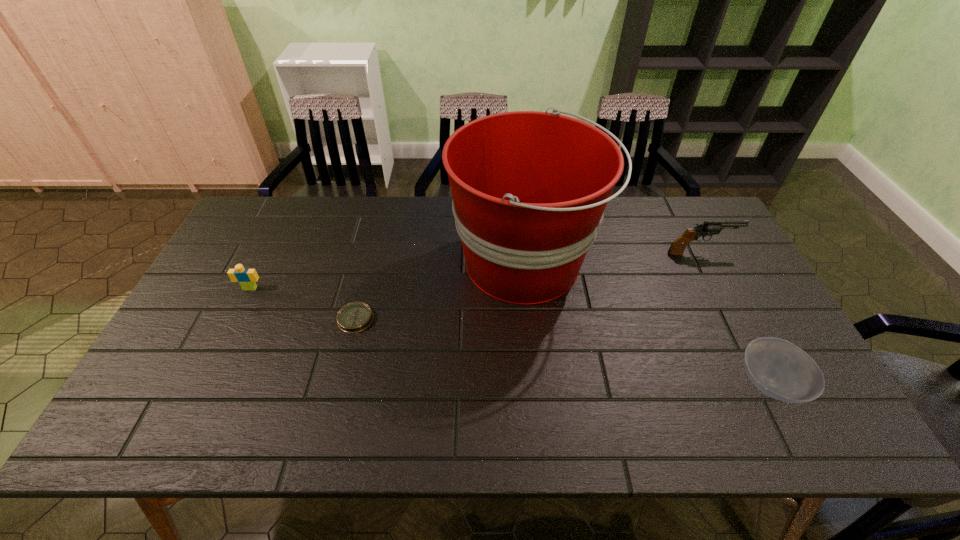
Locate an element on the screen. the third object from left to right is located at coordinates (529, 188).

Find the location of `the tallest object`. the tallest object is located at coordinates (529, 188).

At what (x,y) coordinates should I click in order to perform the action: click on the fourth shortest object. Please return your answer as a coordinate pair (x, y). The height and width of the screenshot is (540, 960). Looking at the image, I should click on (708, 228).

The image size is (960, 540). Find the location of `the leftmost object`. the leftmost object is located at coordinates (246, 277).

The width and height of the screenshot is (960, 540). Identify the location of the third tallest object. (246, 277).

Where is `the nearest object`? The width and height of the screenshot is (960, 540). the nearest object is located at coordinates (781, 370).

Find the location of `bowl`. bowl is located at coordinates (781, 370).

Identify the location of the fourth object from right to left. This screenshot has width=960, height=540. (354, 317).

What are the coordinates of `the shortest object` in the screenshot? It's located at (354, 317).

Find the location of a particular element. The height and width of the screenshot is (540, 960). vacant space located on the right of the bucket is located at coordinates (667, 264).